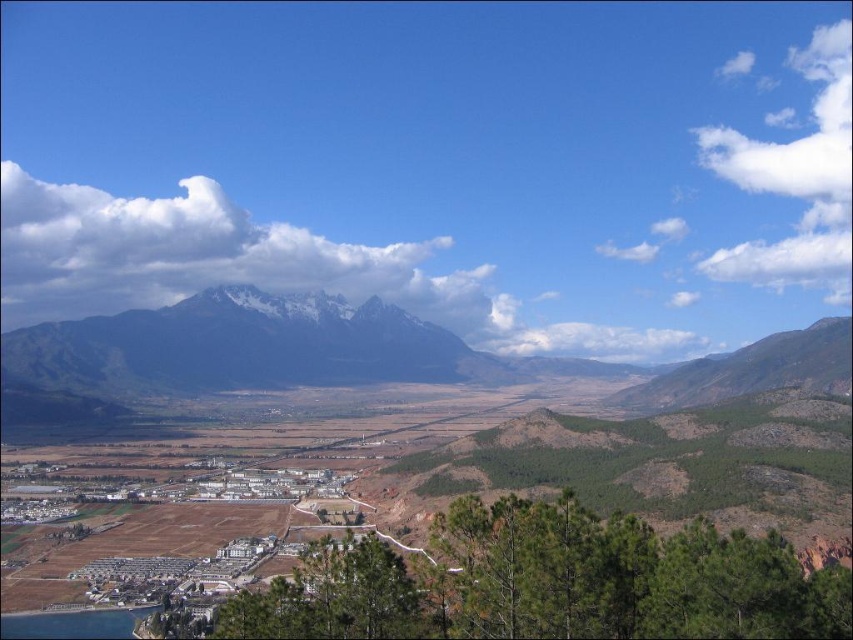
You are an airplane pilot flying over the mountainous landscape. You notice the white fluffy cloud at upper left and the snowy granite mountain range at center. Which one appears higher in the sky from your perspective?

The white fluffy cloud at upper left appears higher in the sky than the snowy granite mountain range at center because it is much taller.

Based on the photo, you are a landscape photographer planning to capture the entire snowy granite mountain range at center and white fluffy cloud at upper left in one frame. Based on the scene, can you fit both objects within the camera frame without cropping?

The white fluffy cloud at upper left is wider than the snowy granite mountain range at center, so it is possible to fit both within the camera frame without cropping as the cloud is wider and can accommodate the mountain range within the same view.

You are a photographer standing at the center of the image. You want to capture a photo of the white fluffy cloud at upper left. Which direction should you point your camera to ensure the cloud is in the frame?

You should point your camera to the upper left direction to capture the white fluffy cloud at upper left, as it is located at point coordinates of (254,268).